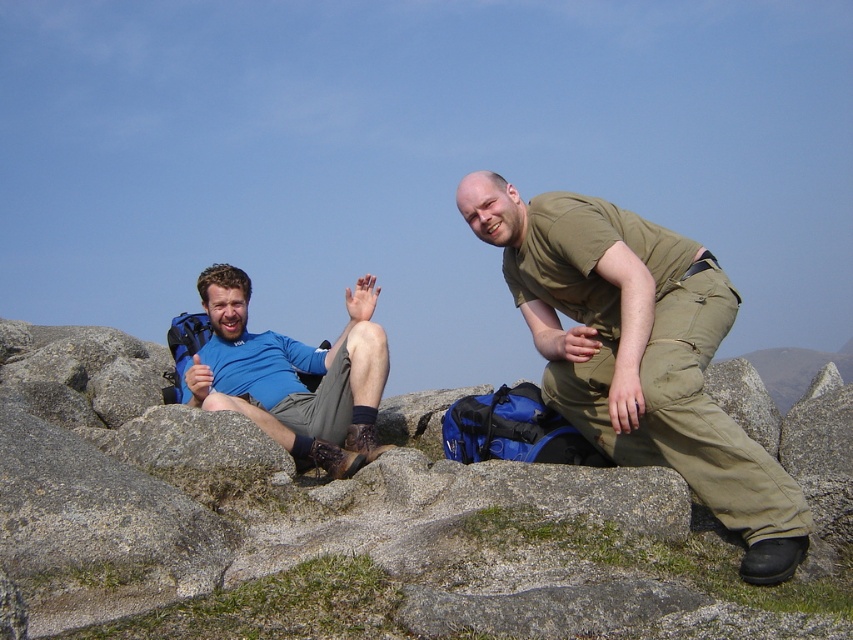
You are a hiker who wants to place a small first aid kit on the ground between the two hikers. The coordinates of the point where you want to place it are given as point (637, 353). Is this point between the two hikers?

The olive green fabric pants at center is located at point (637, 353), so the point is near the olive green fabric pants at center, which is one of the hikers. Therefore, placing the first aid kit there would be near that hiker rather than between them.

You are a photographer trying to capture a photo of both the olive green fabric pants at center and the blue fabric shirt at left. Based on their positions, which one should you focus on first to ensure both are in clear view?

You should focus on the olive green fabric pants at center first because it is closer to the viewer than the blue fabric shirt at left, so adjusting focus starting from the closer object will help ensure both are in clear view.